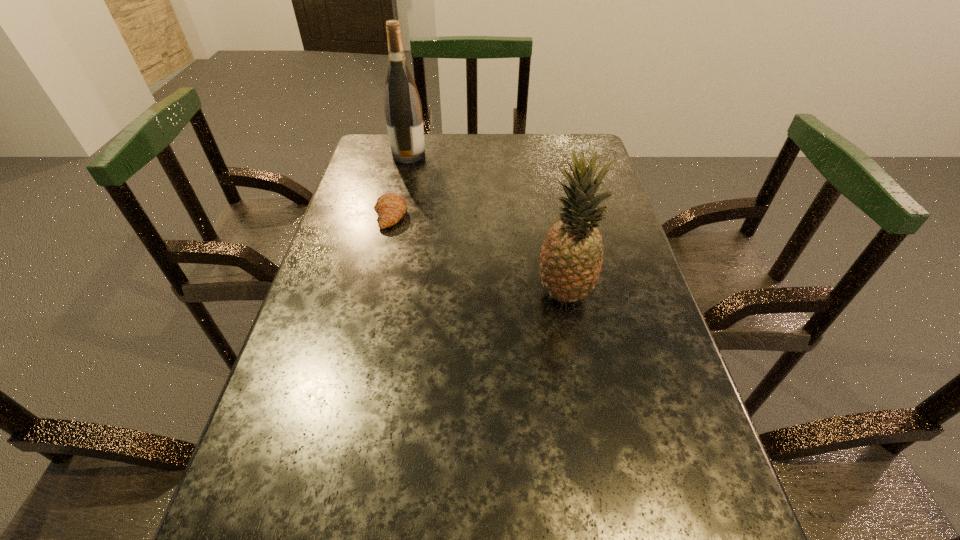
This screenshot has width=960, height=540. Identify the location of crescent roll that is at the left edge. (390, 207).

Locate an element on the screen. object present at the right edge is located at coordinates [571, 257].

Locate an element on the screen. This screenshot has height=540, width=960. object present at the far left corner is located at coordinates (403, 111).

Image resolution: width=960 pixels, height=540 pixels. Identify the location of free region at the far edge. (438, 156).

You are a GUI agent. You are given a task and a screenshot of the screen. Output one action in this format:
    pyautogui.click(x=<x>, y=<y>)
    Task: Click on the vacant space at the left edge of the desktop
    This screenshot has width=960, height=540.
    Given the screenshot: What is the action you would take?
    pyautogui.click(x=333, y=278)

The height and width of the screenshot is (540, 960). In order to click on free space at the right edge of the desktop in this screenshot , I will do `click(703, 467)`.

Image resolution: width=960 pixels, height=540 pixels. What are the coordinates of `free point at the far right corner` in the screenshot? It's located at pyautogui.click(x=551, y=136).

Where is `vacant space that is in between the pineapple and the wine bottle`? vacant space that is in between the pineapple and the wine bottle is located at coordinates (487, 224).

You are a GUI agent. You are given a task and a screenshot of the screen. Output one action in this format:
    pyautogui.click(x=<x>, y=<y>)
    Task: Click on the free space between the wine bottle and the rightmost object
    The width and height of the screenshot is (960, 540).
    Given the screenshot: What is the action you would take?
    pyautogui.click(x=487, y=224)

Locate an element on the screen. This screenshot has height=540, width=960. free space between the crescent roll and the farthest object is located at coordinates (400, 185).